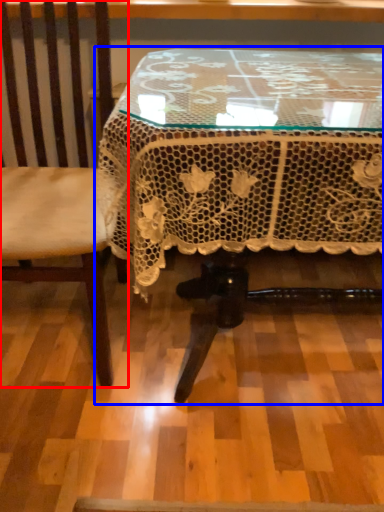
Question: Which object appears farthest to the camera in this image, chair (highlighted by a red box) or table (highlighted by a blue box)?

Choices:
 (A) chair
 (B) table

Answer: (A)